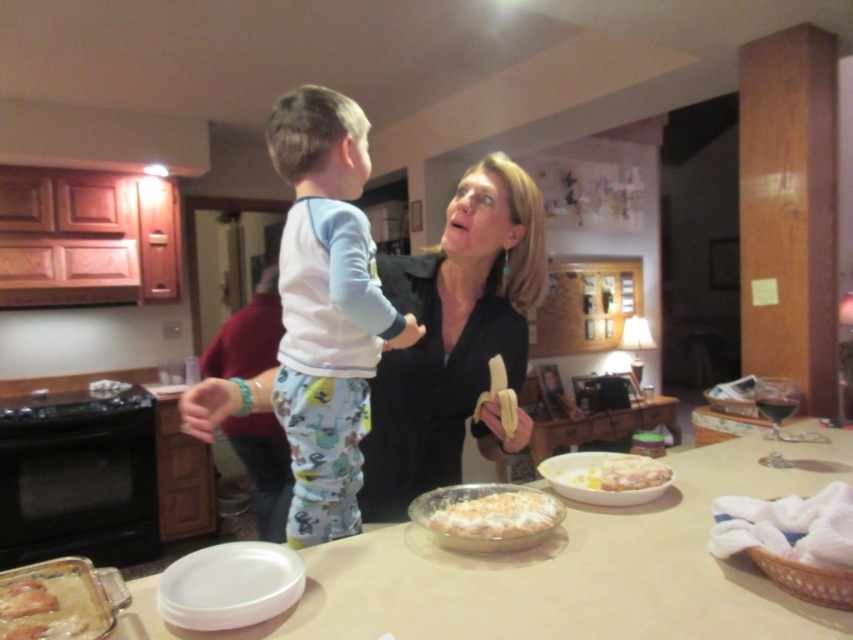
Measure the distance between matte black shirt at center and light blue cotton pajamas at center.

17.76 centimeters

Between matte black shirt at center and light blue cotton pajamas at center, which one is positioned higher?

light blue cotton pajamas at center is higher up.

Is point (496, 289) positioned after point (352, 237)?

That is True.

You are a GUI agent. You are given a task and a screenshot of the screen. Output one action in this format:
    pyautogui.click(x=<x>, y=<y>)
    Task: Click on the matte black shirt at center
    
    Given the screenshot: What is the action you would take?
    pyautogui.click(x=453, y=332)

Based on the photo, can you confirm if matte black shirt at center is smaller than white creamy pasta at center?

Incorrect, matte black shirt at center is not smaller in size than white creamy pasta at center.

Is matte black shirt at center wider than white creamy pasta at center?

Yes.

Between point (476, 320) and point (634, 476), which one is positioned behind?

The point (476, 320) is more distant.

Locate an element on the screen. The width and height of the screenshot is (853, 640). matte black shirt at center is located at coordinates tap(453, 332).

Between point (538, 499) and point (628, 481), which one is positioned in front?

Positioned in front is point (538, 499).

Which is below, white fluffy pie at center or white creamy pasta at center?

white fluffy pie at center is below.

Measure the distance between white fluffy pie at center and camera.

white fluffy pie at center and camera are 3.70 feet apart.

Image resolution: width=853 pixels, height=640 pixels. I want to click on white fluffy pie at center, so click(498, 515).